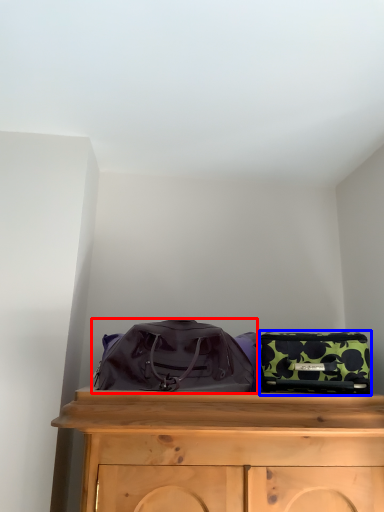
Question: Among these objects, which one is nearest to the camera, luggage and bags (highlighted by a red box) or luggage and bags (highlighted by a blue box)?

Choices:
 (A) luggage and bags
 (B) luggage and bags

Answer: (A)